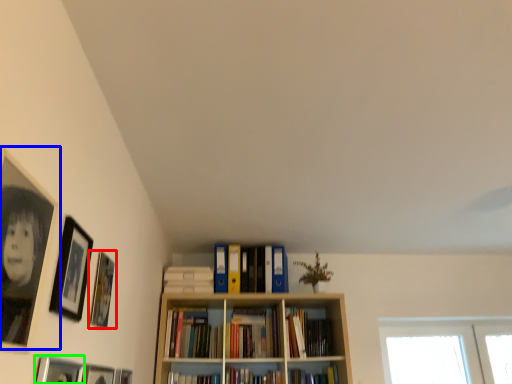
Question: Based on their relative distances, which object is nearer to picture frame (highlighted by a red box)? Choose from picture frame (highlighted by a blue box) and picture frame (highlighted by a green box).

Choices:
 (A) picture frame
 (B) picture frame

Answer: (B)